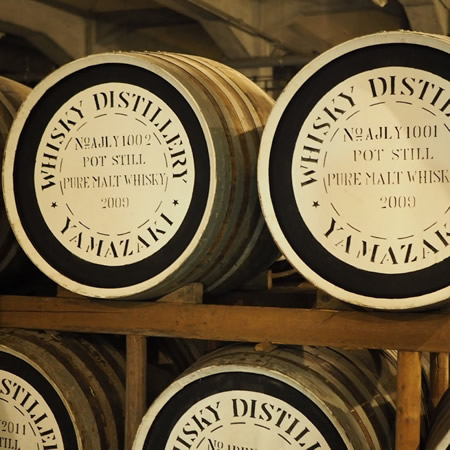
Where is `two barrels on top shelf`? The image size is (450, 450). two barrels on top shelf is located at coordinates (x=354, y=194), (x=135, y=253).